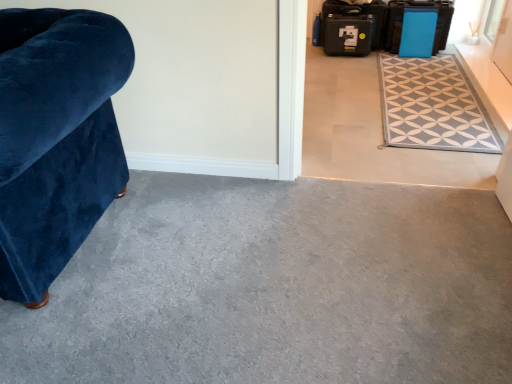
Question: Is blue plastic suitcase at upper right, positioned as the 1th luggage in right-to-left order, bigger than velvet blue armchair at left?

Choices:
 (A) no
 (B) yes

Answer: (A)

Question: Considering the relative sizes of blue plastic suitcase at upper right, positioned as the 1th luggage in right-to-left order, and velvet blue armchair at left in the image provided, is blue plastic suitcase at upper right, positioned as the 1th luggage in right-to-left order, smaller than velvet blue armchair at left?

Choices:
 (A) yes
 (B) no

Answer: (A)

Question: Is blue plastic suitcase at upper right, placed as the 3th luggage when sorted from left to right, positioned behind velvet blue armchair at left?

Choices:
 (A) yes
 (B) no

Answer: (A)

Question: From the image's perspective, is blue plastic suitcase at upper right, placed as the 3th luggage when sorted from left to right, above velvet blue armchair at left?

Choices:
 (A) yes
 (B) no

Answer: (A)

Question: Considering the relative positions of blue plastic suitcase at upper right, positioned as the 1th luggage in right-to-left order, and velvet blue armchair at left in the image provided, is blue plastic suitcase at upper right, positioned as the 1th luggage in right-to-left order, to the left of velvet blue armchair at left from the viewer's perspective?

Choices:
 (A) yes
 (B) no

Answer: (B)

Question: Is blue plastic suitcase at upper right, positioned as the 1th luggage in right-to-left order, facing towards velvet blue armchair at left?

Choices:
 (A) no
 (B) yes

Answer: (A)

Question: Are black plastic suitcase at upper right, the first luggage in the left-to-right sequence, and blue plastic suitcase at upper right, positioned as the 1th luggage in right-to-left order, making contact?

Choices:
 (A) no
 (B) yes

Answer: (A)

Question: Is black plastic suitcase at upper right, the first luggage in the left-to-right sequence, not near blue plastic suitcase at upper right, placed as the 3th luggage when sorted from left to right?

Choices:
 (A) yes
 (B) no

Answer: (B)

Question: From the image's perspective, is black plastic suitcase at upper right, the first luggage in the left-to-right sequence, beneath blue plastic suitcase at upper right, placed as the 3th luggage when sorted from left to right?

Choices:
 (A) yes
 (B) no

Answer: (B)

Question: Is black plastic suitcase at upper right, the first luggage in the left-to-right sequence, facing towards blue plastic suitcase at upper right, positioned as the 1th luggage in right-to-left order?

Choices:
 (A) yes
 (B) no

Answer: (B)

Question: Does black plastic suitcase at upper right, which is the 3th luggage from right to left, have a greater width compared to blue plastic suitcase at upper right, positioned as the 1th luggage in right-to-left order?

Choices:
 (A) yes
 (B) no

Answer: (B)

Question: From a real-world perspective, is black plastic suitcase at upper right, the first luggage in the left-to-right sequence, physically above blue plastic suitcase at upper right, placed as the 3th luggage when sorted from left to right?

Choices:
 (A) yes
 (B) no

Answer: (B)

Question: Is velvet blue armchair at left facing away from black plastic suitcase at upper right, the first luggage in the left-to-right sequence?

Choices:
 (A) yes
 (B) no

Answer: (A)